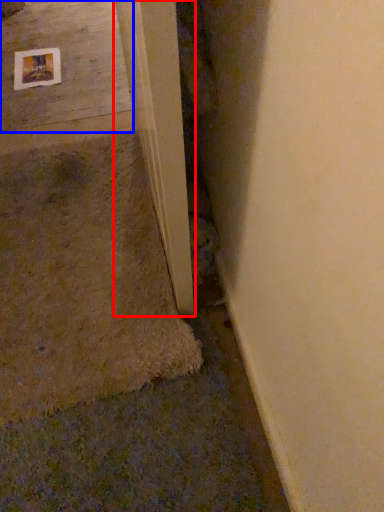
Question: Which object is closer to the camera taking this photo, beam (highlighted by a red box) or concrete (highlighted by a blue box)?

Choices:
 (A) beam
 (B) concrete

Answer: (A)